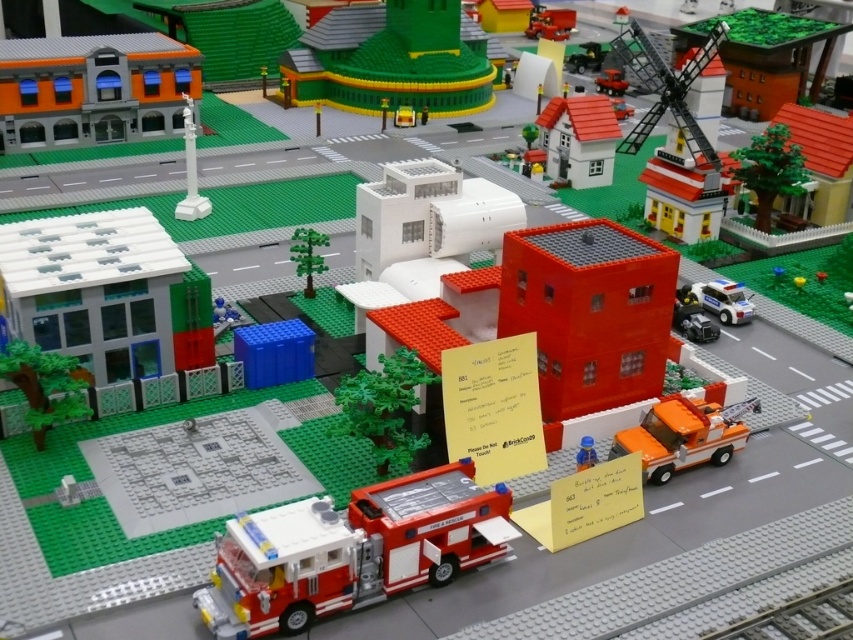
Question: Does green matte tree at center appear under brick-like yellow brick at center?

Choices:
 (A) no
 (B) yes

Answer: (B)

Question: Which point is farther from the camera taking this photo?

Choices:
 (A) (549, 33)
 (B) (398, 42)
 (C) (718, 36)

Answer: (A)

Question: Which object is closer to the camera taking this photo?

Choices:
 (A) smooth plastic toy car at upper center
 (B) brick-like yellow brick at center

Answer: (B)

Question: Based on their relative distances, which object is nearer to the orange matte tow truck at lower right?

Choices:
 (A) black plastic windmill at upper right
 (B) smooth plastic toy car at upper center
 (C) white plastic police car at right
 (D) green matte tree at center

Answer: (C)

Question: From the image, what is the correct spatial relationship of brick red fire truck at lower center in relation to white plastic police car at right?

Choices:
 (A) left
 (B) right

Answer: (A)

Question: Is brick red fire truck at lower center to the right of orange matte tow truck at lower right from the viewer's perspective?

Choices:
 (A) no
 (B) yes

Answer: (A)